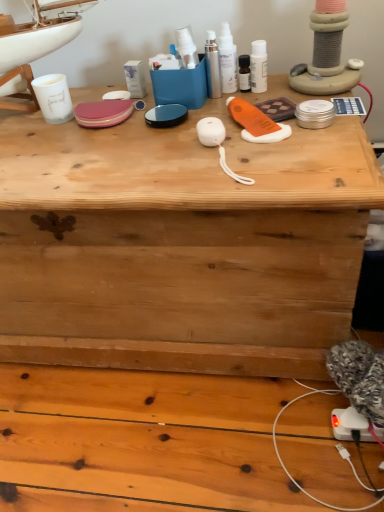
Locate an element on the screen. vacant space in front of sleek silver spray at center, arranged as the third toiletry when viewed from the right is located at coordinates (198, 131).